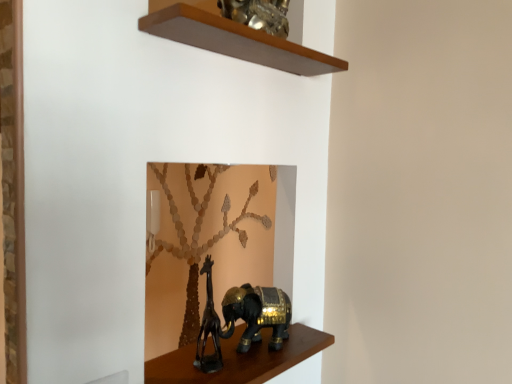
Question: Is point (179, 14) closer or farther from the camera than point (308, 334)?

Choices:
 (A) farther
 (B) closer

Answer: (B)

Question: From the image's perspective, is wooden shelf at upper center, which is counted as the 2th shelf, starting from the bottom, above or below shiny black elephant at lower center, the 2th shelf when ordered from top to bottom?

Choices:
 (A) below
 (B) above

Answer: (B)

Question: Based on their relative distances, which object is nearer to the shiny black elephant at lower center, which is the 1th shelf in bottom-to-top order?

Choices:
 (A) black matte giraffe at lower center
 (B) gold metallic elephant at center
 (C) wooden shelf at upper center, placed as the 1th shelf when sorted from top to bottom

Answer: (B)

Question: Which object is the closest to the wooden shelf at upper center, placed as the 1th shelf when sorted from top to bottom?

Choices:
 (A) shiny black elephant at lower center, which is the 1th shelf in bottom-to-top order
 (B) gold metallic elephant at center
 (C) black matte giraffe at lower center

Answer: (B)